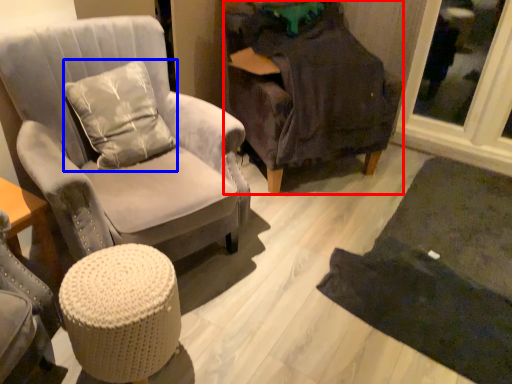
Question: Which point is further to the camera, chair (highlighted by a red box) or pillow (highlighted by a blue box)?

Choices:
 (A) chair
 (B) pillow

Answer: (A)